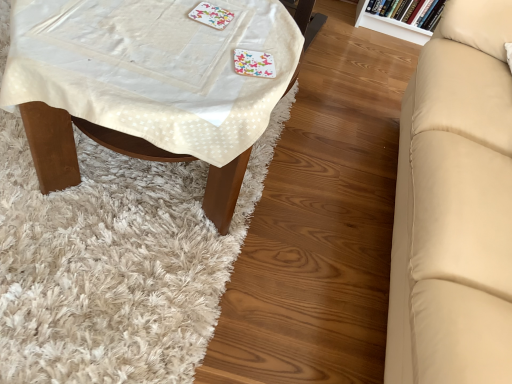
The height and width of the screenshot is (384, 512). In order to click on vacant area that is in front of colorful paper coaster at upper center in this screenshot , I will do `click(197, 51)`.